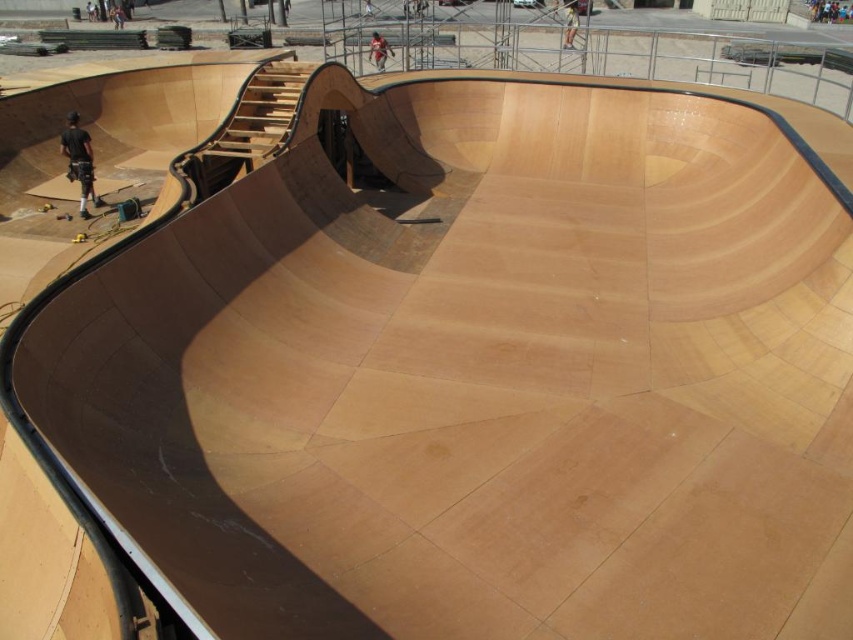
You are a photographer positioned at the bottom of the skatepark bowl. You want to capture both the black leather pants at left and the light brown wooden skateboarder at upper center in your shot. Which subject will appear smaller in the photo?

The black leather pants at left will appear smaller in the photo because it has a lesser height compared to the light brown wooden skateboarder at upper center.

You are a construction worker standing at point [79,161]. You need to move to the nearest edge of the wooden skatepark bowl. Is the distance from your current position to the nearest edge of the wooden skatepark bowl more than 1 meter?

The nearest edge of the wooden skatepark bowl is less than 1 meter away from point [79,161], so the distance is not more than 1 meter.

You are standing at the edge of the skatepark bowl and want to take a photo. You notice two points marked on the bowl surface at coordinates point (376, 49) and point (569, 45). Which point will appear larger in your photo?

Point (376, 49) will appear larger in the photo because it is closer to the camera than point (569, 45).